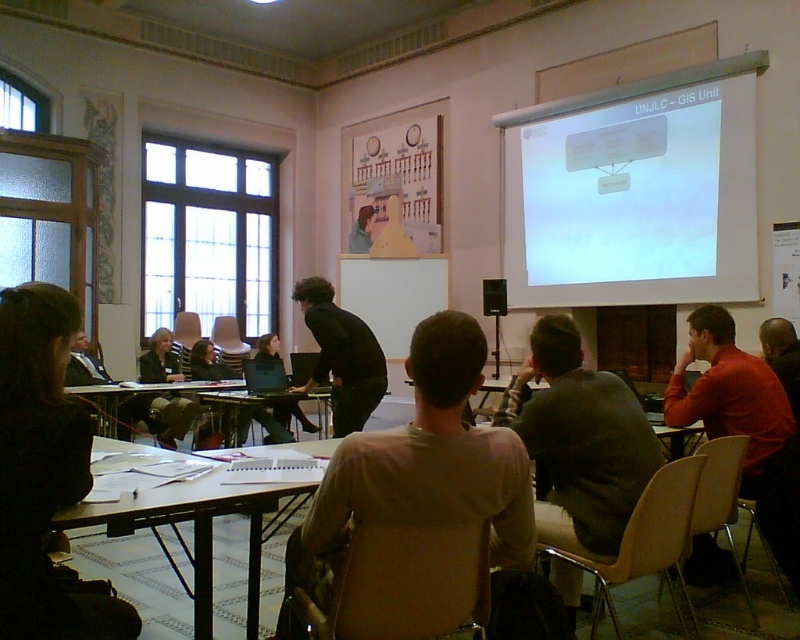
Question: Which object is farther from the camera taking this photo?

Choices:
 (A) black plastic speaker at center
 (B) dark gray shirt at center
 (C) brown cotton shirt at center
 (D) white paper at lower center

Answer: (A)

Question: Is brown cotton shirt at center smaller than dark brown hair at right?

Choices:
 (A) yes
 (B) no

Answer: (B)

Question: Can you confirm if white paper at lower center is positioned above white plastic table at center?

Choices:
 (A) yes
 (B) no

Answer: (B)

Question: Can you confirm if white plastic table at lower center is wider than dark blue sweater at center?

Choices:
 (A) no
 (B) yes

Answer: (B)

Question: Which object is farther from the camera taking this photo?

Choices:
 (A) black fabric jacket at lower left
 (B) dark brown leather jacket at lower left
 (C) black matte/black suit at center

Answer: (B)

Question: Which of these objects is positioned farthest from the white matte projector screen at upper right?

Choices:
 (A) dark brown hair at right
 (B) dark brown leather jacket at lower left
 (C) black matte/black suit at center
 (D) white plastic table at center

Answer: (B)